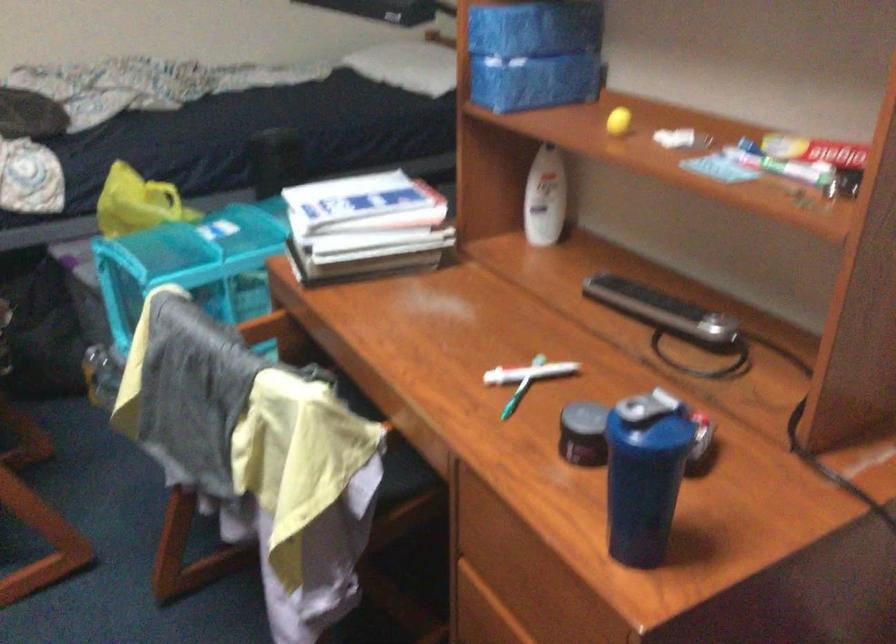
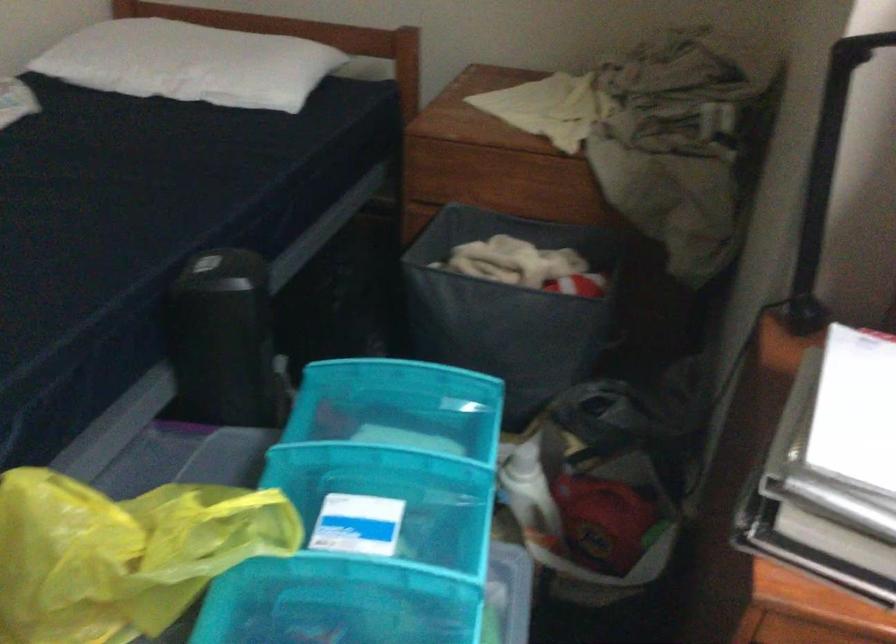
Locate, in the second image, the point that corresponds to the point at 271,134 in the first image.

(225, 268)